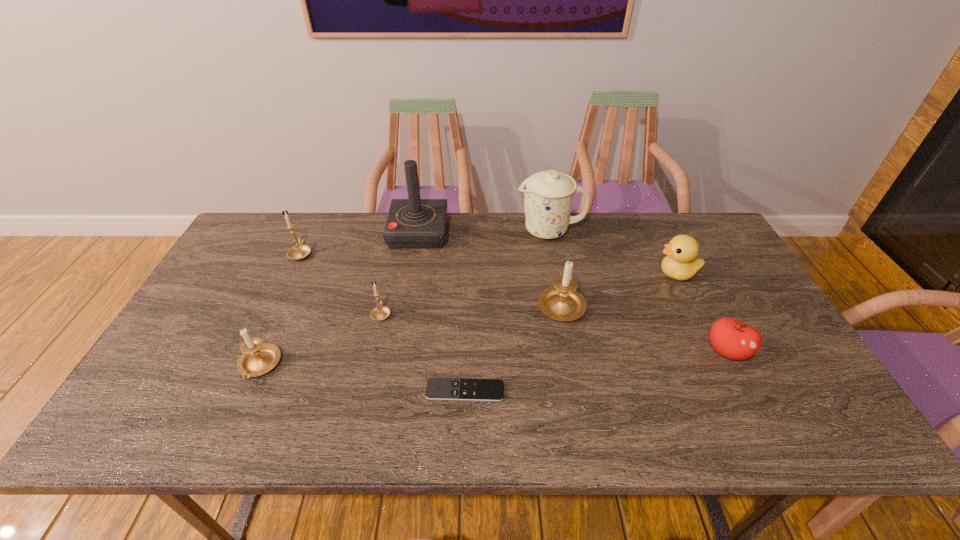
The image size is (960, 540). Identify the location of vacant point at the left edge. (196, 334).

You are a GUI agent. You are given a task and a screenshot of the screen. Output one action in this format:
    pyautogui.click(x=<x>, y=<y>)
    Task: Click on the vacant space at the right edge of the desktop
    This screenshot has width=960, height=540.
    Given the screenshot: What is the action you would take?
    817,390

What are the coordinates of `vacant space at the far left corner of the desktop` in the screenshot? It's located at (277, 238).

Identify the location of empty space that is in between the apple and the left beige candle holder. The image size is (960, 540). (493, 359).

Locate an element on the screen. The width and height of the screenshot is (960, 540). free space between the chinaware and the duck is located at coordinates (613, 252).

Image resolution: width=960 pixels, height=540 pixels. In order to click on vacant space that is in between the nearer beige candle holder and the apple in this screenshot , I will do `click(493, 359)`.

In order to click on free space between the rightmost candle holder and the yellow duck in this screenshot , I will do pyautogui.click(x=619, y=288).

You are a GUI agent. You are given a task and a screenshot of the screen. Output one action in this format:
    pyautogui.click(x=<x>, y=<y>)
    Task: Click on the unoccupied position between the duck and the bigger gold candle holder
    This screenshot has height=540, width=960.
    Given the screenshot: What is the action you would take?
    pyautogui.click(x=489, y=264)

You are a GUI agent. You are given a task and a screenshot of the screen. Output one action in this format:
    pyautogui.click(x=<x>, y=<y>)
    Task: Click on the free point between the nearer beige candle holder and the joystick
    The width and height of the screenshot is (960, 540).
    Given the screenshot: What is the action you would take?
    pyautogui.click(x=339, y=299)

Locate an element on the screen. The width and height of the screenshot is (960, 540). unoccupied position between the apple and the left beige candle holder is located at coordinates (493, 359).